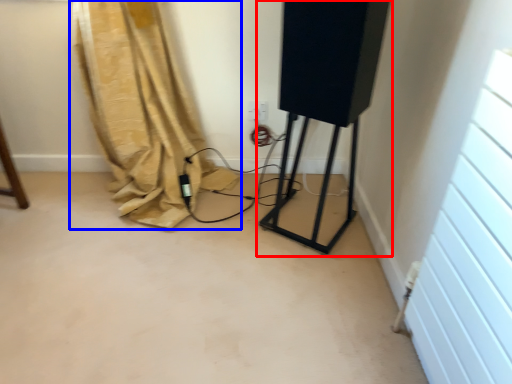
Question: Among these objects, which one is farthest to the camera, equipment (highlighted by a red box) or curtain (highlighted by a blue box)?

Choices:
 (A) equipment
 (B) curtain

Answer: (B)